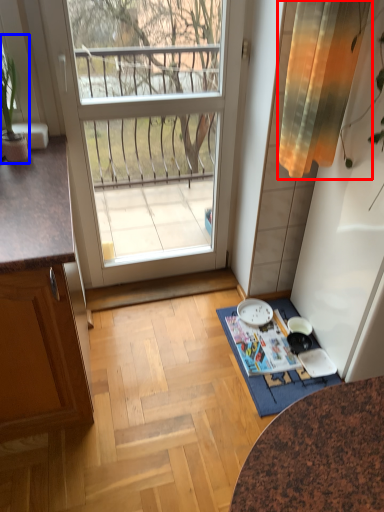
Question: Which object is further to the camera taking this photo, curtain (highlighted by a red box) or houseplant (highlighted by a blue box)?

Choices:
 (A) curtain
 (B) houseplant

Answer: (B)